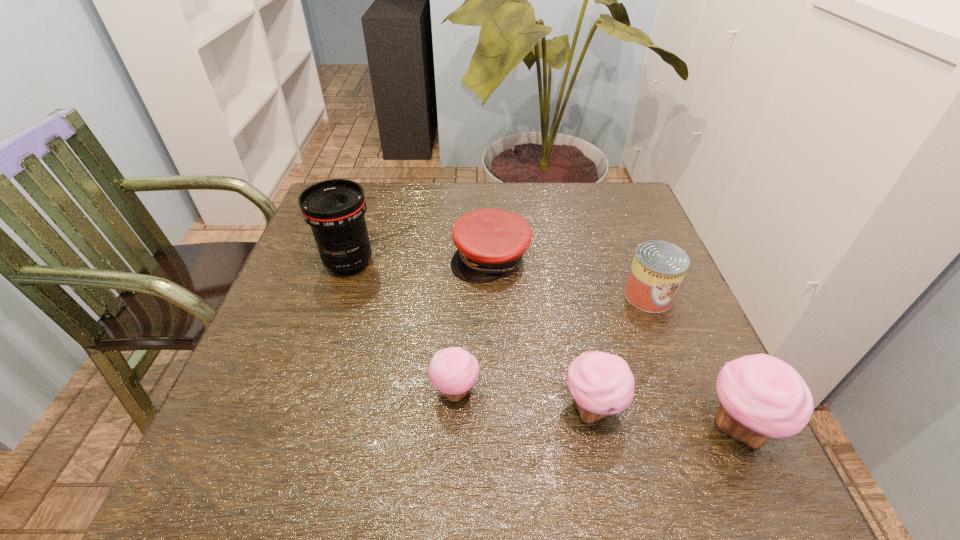
In the image, there is a desktop. Where is `free region at the near edge`? free region at the near edge is located at coordinates (396, 432).

Locate an element on the screen. The image size is (960, 540). vacant space at the left edge of the desktop is located at coordinates tap(305, 294).

In the image, there is a desktop. Where is `free space at the right edge`? The width and height of the screenshot is (960, 540). free space at the right edge is located at coordinates (628, 341).

Where is `blank space at the far right corner of the desktop`? This screenshot has width=960, height=540. blank space at the far right corner of the desktop is located at coordinates (601, 199).

At what (x,y) coordinates should I click in order to perform the action: click on free spot between the shortest cupcake and the telephoto lens. Please return your answer as a coordinate pair (x, y). Looking at the image, I should click on (402, 327).

Locate an element on the screen. The image size is (960, 540). vacant area between the can and the tallest object is located at coordinates click(x=498, y=279).

Find the location of a particular element. The width and height of the screenshot is (960, 540). vacant area that lies between the can and the cap is located at coordinates (569, 276).

Locate an element on the screen. free point between the tallest object and the can is located at coordinates (498, 279).

This screenshot has width=960, height=540. Find the location of `empty space between the can and the third object from right to left`. empty space between the can and the third object from right to left is located at coordinates (620, 352).

Identify the location of free spot between the second cupcake from right to left and the fifth shortest object. The height and width of the screenshot is (540, 960). (x=665, y=417).